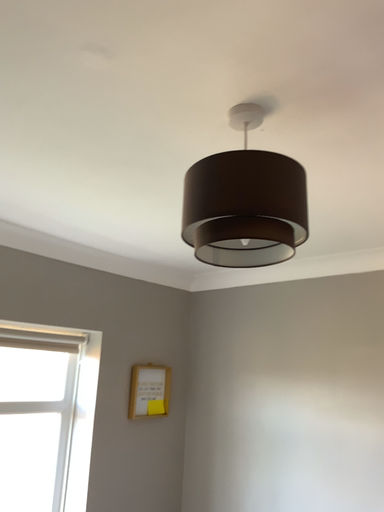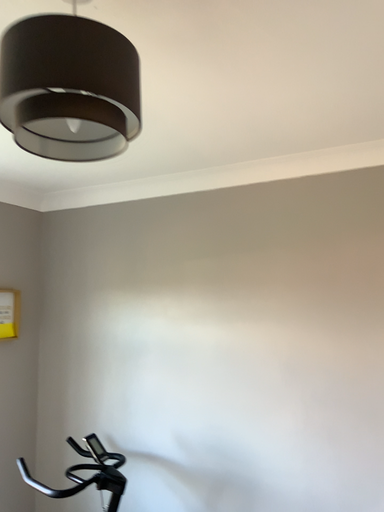
Question: Which way did the camera rotate in the video?

Choices:
 (A) rotated upward
 (B) rotated downward

Answer: (B)